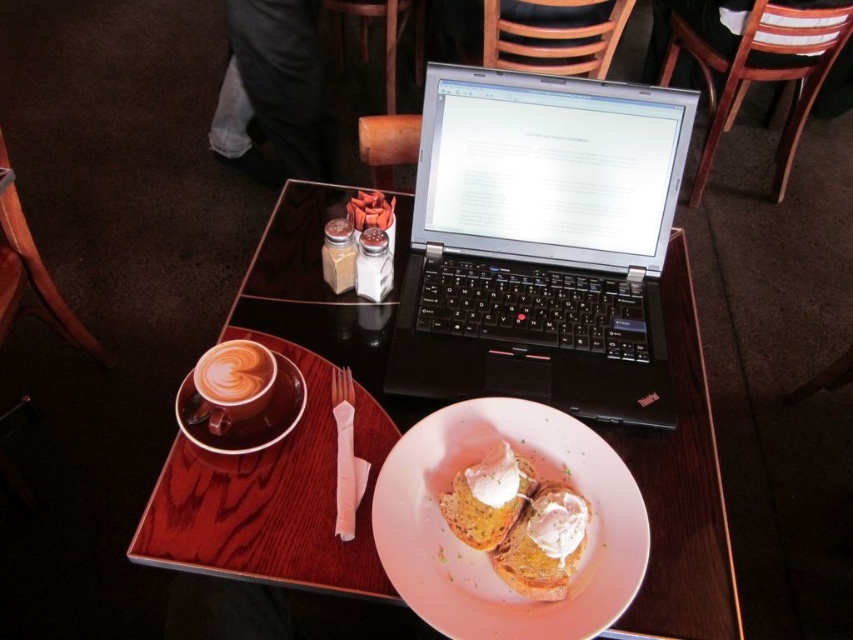
Looking at this image, you are sitting at the table in the image and want to reach both the point at (489,76) and the point at (572,541). Which point will your hand reach first?

The point at (489,76) will be reached first because it is closer to you than the point at (572,541).

You are a barista who just prepared a dessert and needs to place it on the pink matte plate at center. The dessert is 10 centimeters in diameter. Can you fit the dessert on the plate without it overhanging the edges?

The pink matte plate at center is 58.76 centimeters away from the viewer, but this distance does not indicate the plate size. The question about fitting the dessert requires knowing the plate diameter, which is not provided in the objects description. Therefore, it is impossible to determine if the dessert will fit based on the given information.

From the picture: You have a large book that measures 20 inches in length. You want to place it on the wooden table at center next to the black plastic laptop at center. Considering their sizes, will the book fit on the table without overlapping the laptop?

The black plastic laptop at center is smaller than the wooden table at center, so there should be enough space on the wooden table at center to place the large book next to the laptop without overlapping.